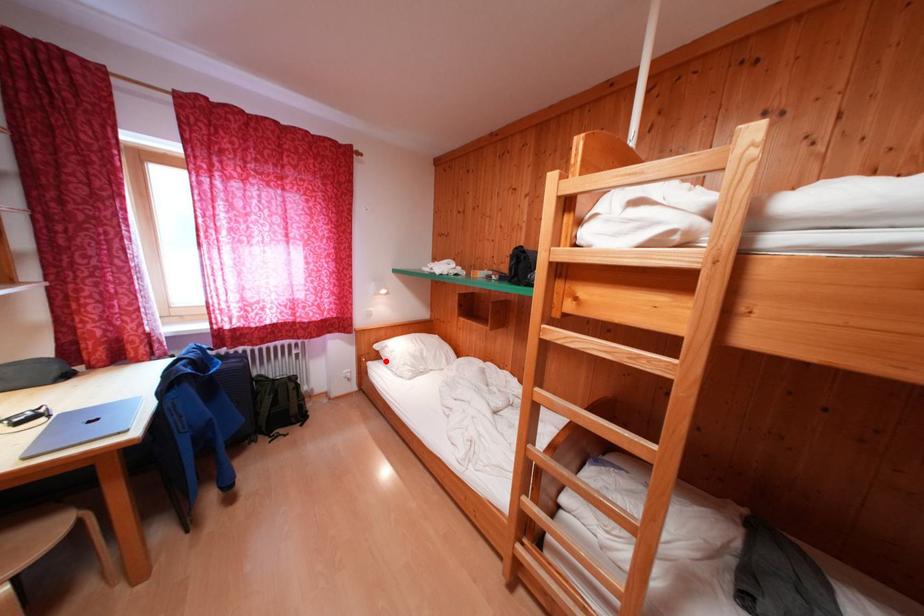
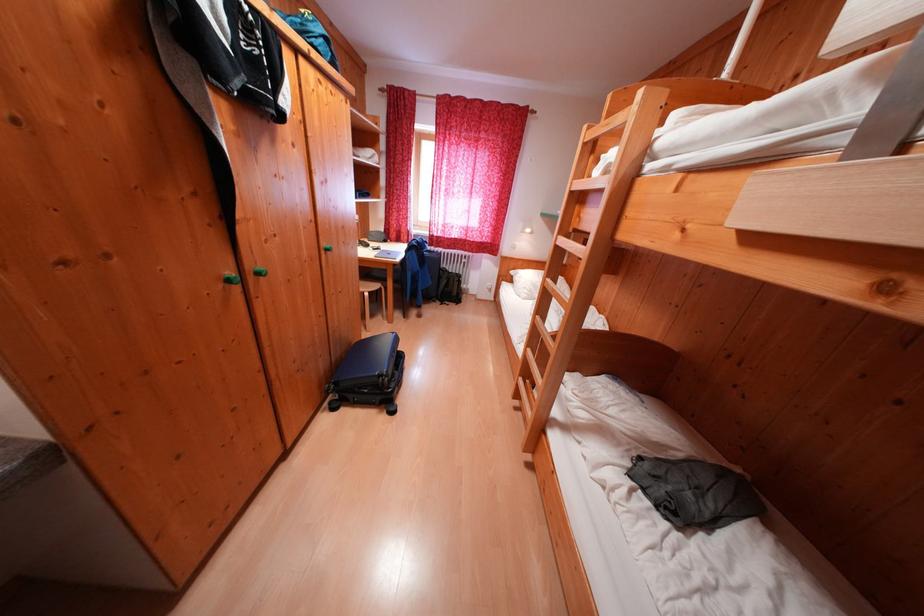
Question: I am providing you with two images of the same scene from different viewpoints. Image1 has a red point marked. In image2, the corresponding 3D location appears at what relative position? Reply with the corresponding letter.

Choices:
 (A) Closer
 (B) Farther

Answer: (A)